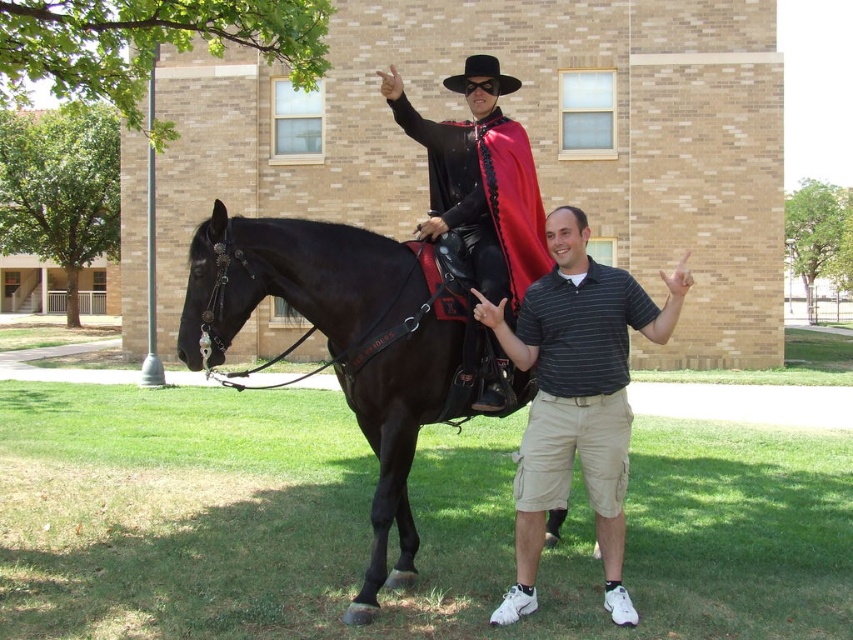
Which is in front, point (372, 502) or point (386, 97)?

Point (372, 502)

Can you confirm if shiny black horse at center is shorter than shiny black cape at center?

Yes, shiny black horse at center is shorter than shiny black cape at center.

Image resolution: width=853 pixels, height=640 pixels. What do you see at coordinates (339, 342) in the screenshot? I see `shiny black horse at center` at bounding box center [339, 342].

The width and height of the screenshot is (853, 640). Identify the location of shiny black horse at center. (339, 342).

Between shiny black horse at center and khaki cargo shorts at lower right, which one is positioned higher?

shiny black horse at center is higher up.

Is shiny black horse at center closer to the viewer compared to khaki cargo shorts at lower right?

No, it is not.

You are a GUI agent. You are given a task and a screenshot of the screen. Output one action in this format:
    pyautogui.click(x=<x>, y=<y>)
    Task: Click on the shiny black horse at center
    The height and width of the screenshot is (640, 853).
    Given the screenshot: What is the action you would take?
    pyautogui.click(x=339, y=342)

Does khaki cargo shorts at lower right lie in front of shiny black cape at center?

Yes, khaki cargo shorts at lower right is closer to the viewer.

Is khaki cargo shorts at lower right smaller than shiny black cape at center?

No, khaki cargo shorts at lower right is not smaller than shiny black cape at center.

Between point (548, 304) and point (476, 116), which one is positioned in front?

Point (548, 304) is in front.

Where is `khaki cargo shorts at lower right`? khaki cargo shorts at lower right is located at coordinates (576, 397).